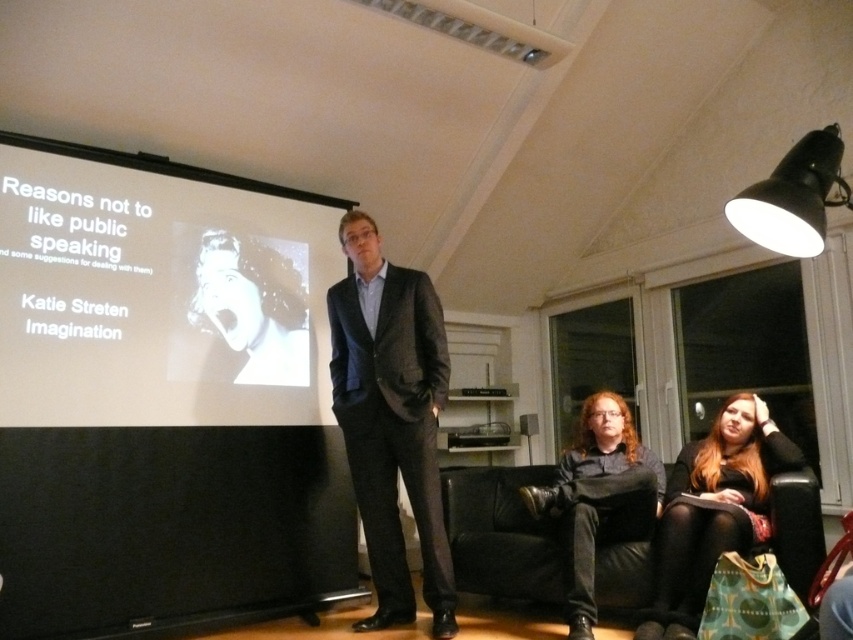
Does long brown hair at lower right have a greater width compared to dark brown leather jacket at lower center?

Correct, the width of long brown hair at lower right exceeds that of dark brown leather jacket at lower center.

Who is positioned more to the left, long brown hair at lower right or dark brown leather jacket at lower center?

dark brown leather jacket at lower center

Is point (788, 442) in front of point (614, 531)?

Yes, point (788, 442) is closer to viewer.

The height and width of the screenshot is (640, 853). Identify the location of long brown hair at lower right. (714, 509).

Is point (436, 330) closer to viewer compared to point (532, 422)?

Yes.

What do you see at coordinates (392, 419) in the screenshot? I see `dark gray textured suit at center` at bounding box center [392, 419].

Which is in front, point (390, 314) or point (520, 433)?

Point (390, 314)

Where is `dark gray textured suit at center`? The height and width of the screenshot is (640, 853). dark gray textured suit at center is located at coordinates (392, 419).

Does dark brown leather jacket at lower center have a larger size compared to black metal lamp at upper right?

Indeed, dark brown leather jacket at lower center has a larger size compared to black metal lamp at upper right.

Who is more distant from viewer, (602, 467) or (842, 189)?

Point (602, 467)

At what (x,y) coordinates should I click in order to perform the action: click on dark brown leather jacket at lower center. Please return your answer as a coordinate pair (x, y). This screenshot has width=853, height=640. Looking at the image, I should click on (595, 497).